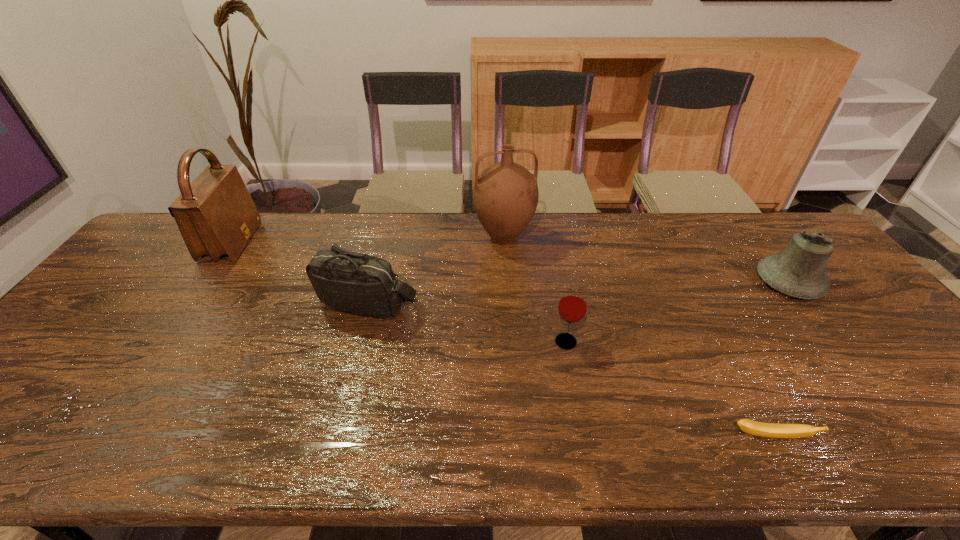
Locate an element on the screen. This screenshot has height=540, width=960. free space located 0.050m on the front of the pitcher is located at coordinates (506, 268).

You are a GUI agent. You are given a task and a screenshot of the screen. Output one action in this format:
    pyautogui.click(x=<x>, y=<y>)
    Task: Click on the vacant space located on the front flap of the left shoulder bag
    This screenshot has height=540, width=960.
    Given the screenshot: What is the action you would take?
    pyautogui.click(x=362, y=242)

Find the location of `free space located at the front padded panel of the second object from left to right`. free space located at the front padded panel of the second object from left to right is located at coordinates (346, 382).

This screenshot has width=960, height=540. Find the location of `free region located on the front of the rightmost object`. free region located on the front of the rightmost object is located at coordinates (857, 370).

This screenshot has height=540, width=960. I want to click on vacant region located 0.060m on the front of the glass, so click(571, 372).

Locate an element on the screen. The height and width of the screenshot is (540, 960). pitcher at the far edge is located at coordinates (505, 196).

The width and height of the screenshot is (960, 540). I want to click on shoulder bag that is at the far edge, so click(216, 216).

Identify the location of object that is at the near edge. (774, 430).

Identify the location of object at the right edge. (798, 270).

Where is `free space at the far edge`? Image resolution: width=960 pixels, height=540 pixels. free space at the far edge is located at coordinates (699, 249).